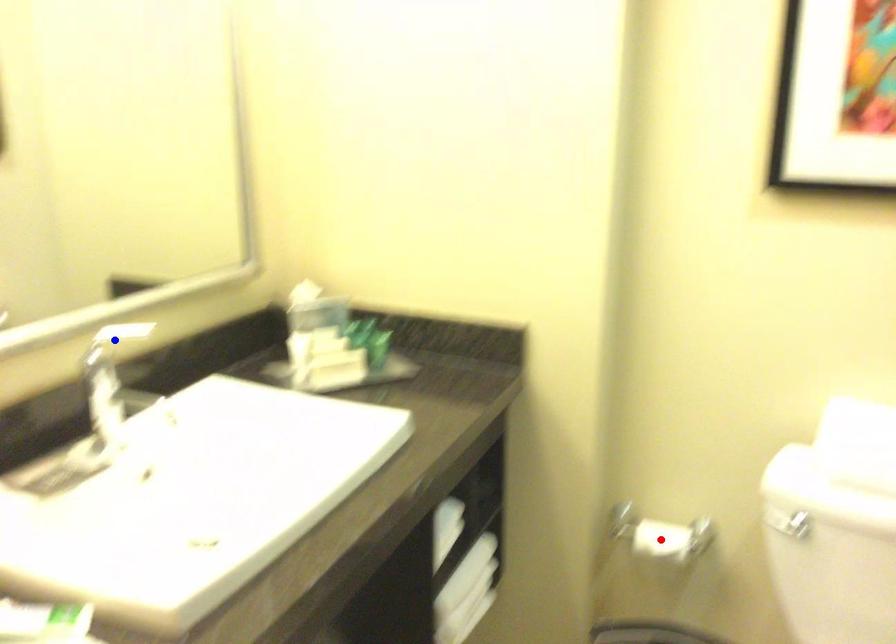
Question: Two points are marked on the image. Which point is closer to the camera?

Choices:
 (A) Blue point is closer.
 (B) Red point is closer.

Answer: (A)